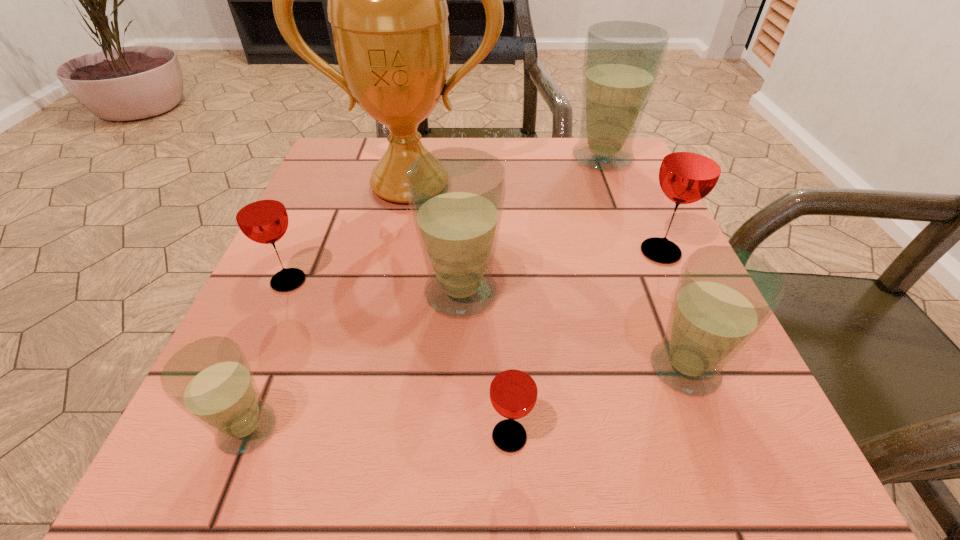
You are a GUI agent. You are given a task and a screenshot of the screen. Output one action in this format:
    pyautogui.click(x=<x>, y=<y>)
    Task: Click on the tallest object
    The image size is (960, 540).
    Given the screenshot: What is the action you would take?
    (386, 0)

You are a GUI agent. You are given a task and a screenshot of the screen. Output one action in this format:
    pyautogui.click(x=<x>, y=<y>)
    Task: Click on the farthest glass
    
    Given the screenshot: What is the action you would take?
    coord(622,59)

Find the location of a particular element. the seventh shortest object is located at coordinates (622, 59).

Where is `the biggest red glass`? The width and height of the screenshot is (960, 540). the biggest red glass is located at coordinates (692, 164).

This screenshot has width=960, height=540. What are the coordinates of `the third nearest blue glass` in the screenshot? It's located at [456, 195].

What are the coordinates of `the third blue glass from right to left` in the screenshot? It's located at (456, 195).

This screenshot has width=960, height=540. What are the coordinates of `the leftmost red glass` in the screenshot? It's located at (260, 213).

The width and height of the screenshot is (960, 540). What are the coordinates of `the second smallest blue glass` in the screenshot? It's located at (724, 295).

You are a GUI agent. You are given a task and a screenshot of the screen. Output one action in this format:
    pyautogui.click(x=<x>, y=<y>)
    Task: Click on the leftmost blue glass
    The image size is (960, 540).
    Given the screenshot: What is the action you would take?
    pyautogui.click(x=210, y=379)

Identify the location of the nearest red glass. (513, 392).